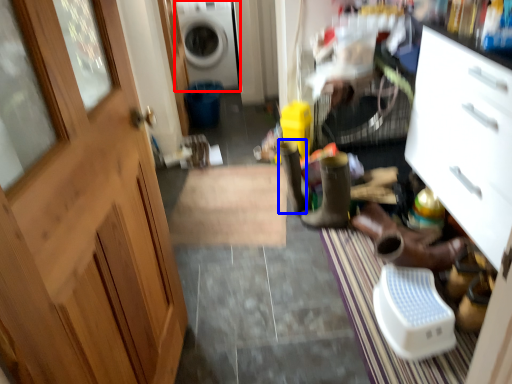
Question: Which point is closer to the camera, washing machine (highlighted by a red box) or boot (highlighted by a blue box)?

Choices:
 (A) washing machine
 (B) boot

Answer: (B)